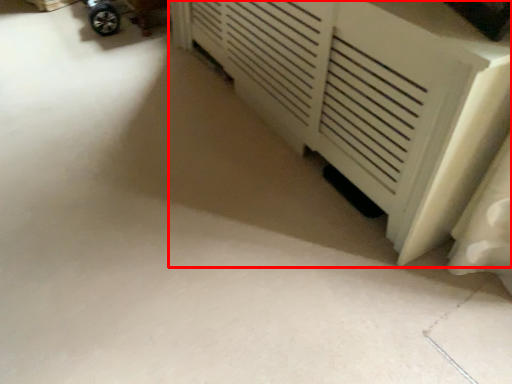
Question: From the image's perspective, what is the correct spatial positioning of furniture (annotated by the red box) in reference to wheel?

Choices:
 (A) below
 (B) above

Answer: (A)